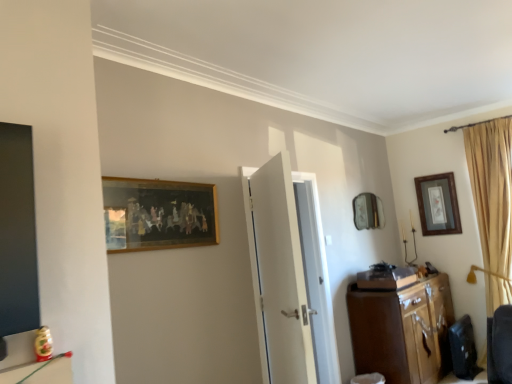
Question: From a real-world perspective, is wooden picture frame at upper right, the first picture frame positioned from the back, below wooden cabinet at right?

Choices:
 (A) no
 (B) yes

Answer: (A)

Question: Is wooden picture frame at upper right, the first picture frame positioned from the back, far away from wooden cabinet at right?

Choices:
 (A) no
 (B) yes

Answer: (B)

Question: From the image's perspective, would you say wooden picture frame at upper right, which is the second picture frame in left-to-right order, is positioned over wooden cabinet at right?

Choices:
 (A) no
 (B) yes

Answer: (B)

Question: Can you confirm if wooden picture frame at upper right, marked as the second picture frame in a front-to-back arrangement, is taller than wooden cabinet at right?

Choices:
 (A) yes
 (B) no

Answer: (B)

Question: From a real-world perspective, does wooden picture frame at upper right, the first picture frame positioned from the back, stand above wooden cabinet at right?

Choices:
 (A) yes
 (B) no

Answer: (A)

Question: From a real-world perspective, is wooden picture frame at upper right, the first picture frame positioned from the back, physically located above or below white glossy door at center?

Choices:
 (A) below
 (B) above

Answer: (B)

Question: Is wooden picture frame at upper right, the first picture frame positioned from the back, in front of or behind white glossy door at center in the image?

Choices:
 (A) behind
 (B) front

Answer: (A)

Question: Is wooden picture frame at upper right, marked as the second picture frame in a front-to-back arrangement, to the left or to the right of white glossy door at center in the image?

Choices:
 (A) right
 (B) left

Answer: (A)

Question: Considering the positions of wooden picture frame at upper right, which appears as the first picture frame when viewed from the right, and white glossy door at center in the image, is wooden picture frame at upper right, which appears as the first picture frame when viewed from the right, bigger or smaller than white glossy door at center?

Choices:
 (A) big
 (B) small

Answer: (B)

Question: Considering the relative positions of white glossy door at center and wooden framed artwork at upper left, placed as the first picture frame when sorted from front to back, in the image provided, is white glossy door at center to the left or to the right of wooden framed artwork at upper left, placed as the first picture frame when sorted from front to back,?

Choices:
 (A) right
 (B) left

Answer: (A)

Question: In terms of width, does white glossy door at center look wider or thinner when compared to wooden framed artwork at upper left, placed as the first picture frame when sorted from front to back?

Choices:
 (A) thin
 (B) wide

Answer: (B)

Question: From a real-world perspective, relative to wooden framed artwork at upper left, which is the first picture frame from left to right, is white glossy door at center vertically above or below?

Choices:
 (A) below
 (B) above

Answer: (A)

Question: Looking at the image, does white glossy door at center seem bigger or smaller compared to wooden framed artwork at upper left, placed as the 2th picture frame when sorted from back to front?

Choices:
 (A) big
 (B) small

Answer: (A)

Question: Based on their positions, is white glossy door at center located to the left or right of wooden cabinet at right?

Choices:
 (A) left
 (B) right

Answer: (A)

Question: From a real-world perspective, is white glossy door at center positioned above or below wooden cabinet at right?

Choices:
 (A) above
 (B) below

Answer: (A)